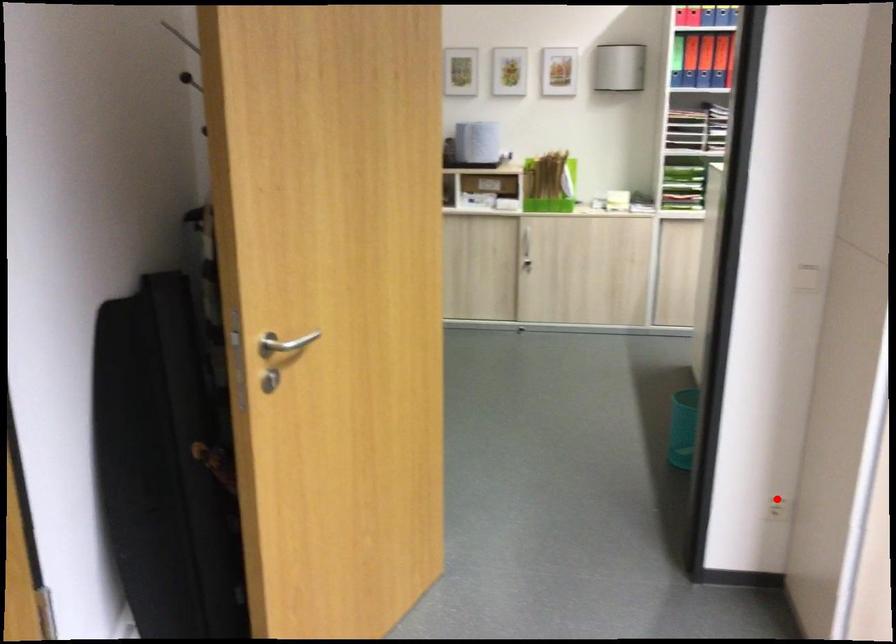
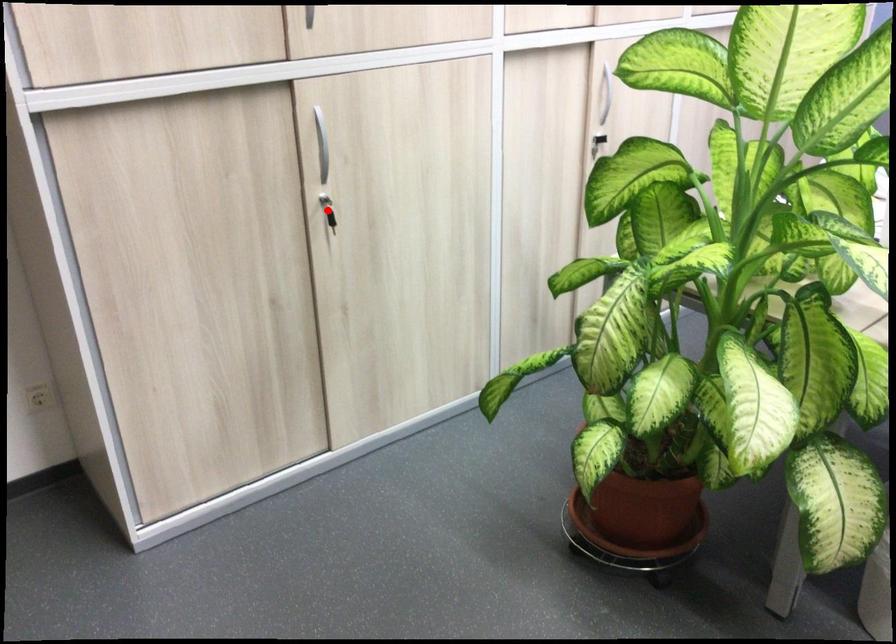
I am providing you with two images of the same scene from different viewpoints. A red point is marked on the first image and another point is marked on the second image. Does the point marked in image1 correspond to the same location as the one in image2?

No